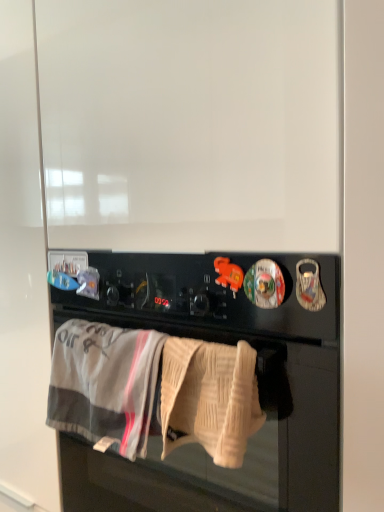
Question: Is black matte oven at center shorter than gray cotton bath towel at lower center, positioned as the first bath towel in left-to-right order?

Choices:
 (A) yes
 (B) no

Answer: (B)

Question: Is black matte oven at center turned away from gray cotton bath towel at lower center, positioned as the first bath towel in left-to-right order?

Choices:
 (A) yes
 (B) no

Answer: (B)

Question: From a real-world perspective, is black matte oven at center on gray cotton bath towel at lower center, which is the 2th bath towel from right to left?

Choices:
 (A) yes
 (B) no

Answer: (B)

Question: Considering the relative sizes of black matte oven at center and gray cotton bath towel at lower center, which is the 2th bath towel from right to left, in the image provided, is black matte oven at center bigger than gray cotton bath towel at lower center, which is the 2th bath towel from right to left,?

Choices:
 (A) yes
 (B) no

Answer: (A)

Question: Considering the relative positions of black matte oven at center and gray cotton bath towel at lower center, which is the 2th bath towel from right to left, in the image provided, is black matte oven at center behind gray cotton bath towel at lower center, which is the 2th bath towel from right to left,?

Choices:
 (A) yes
 (B) no

Answer: (B)

Question: Is black matte oven at center at the left side of gray cotton bath towel at lower center, which is the 2th bath towel from right to left?

Choices:
 (A) yes
 (B) no

Answer: (B)

Question: Is gray cotton bath towel at lower center, which is the 2th bath towel from right to left, shorter than beige knitted towel at lower center, marked as the first bath towel in a right-to-left arrangement?

Choices:
 (A) yes
 (B) no

Answer: (B)

Question: Is gray cotton bath towel at lower center, positioned as the first bath towel in left-to-right order, at the right side of beige knitted towel at lower center, marked as the first bath towel in a right-to-left arrangement?

Choices:
 (A) no
 (B) yes

Answer: (A)

Question: From the image's perspective, does gray cotton bath towel at lower center, positioned as the first bath towel in left-to-right order, appear lower than beige knitted towel at lower center, marked as the first bath towel in a right-to-left arrangement?

Choices:
 (A) yes
 (B) no

Answer: (A)

Question: From a real-world perspective, does gray cotton bath towel at lower center, positioned as the first bath towel in left-to-right order, sit lower than beige knitted towel at lower center, which is the 2th bath towel from left to right?

Choices:
 (A) yes
 (B) no

Answer: (A)

Question: Is gray cotton bath towel at lower center, which is the 2th bath towel from right to left, next to beige knitted towel at lower center, marked as the first bath towel in a right-to-left arrangement?

Choices:
 (A) yes
 (B) no

Answer: (B)

Question: Does gray cotton bath towel at lower center, positioned as the first bath towel in left-to-right order, have a greater height compared to beige knitted towel at lower center, which is the 2th bath towel from left to right?

Choices:
 (A) no
 (B) yes

Answer: (B)

Question: Is beige knitted towel at lower center, which is the 2th bath towel from left to right, in contact with black matte oven at center?

Choices:
 (A) no
 (B) yes

Answer: (A)